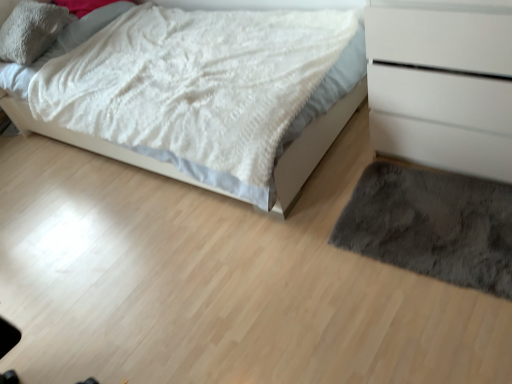
The width and height of the screenshot is (512, 384). Find the location of `free location to the left of dark gray shaggy rug at lower right`. free location to the left of dark gray shaggy rug at lower right is located at coordinates (307, 277).